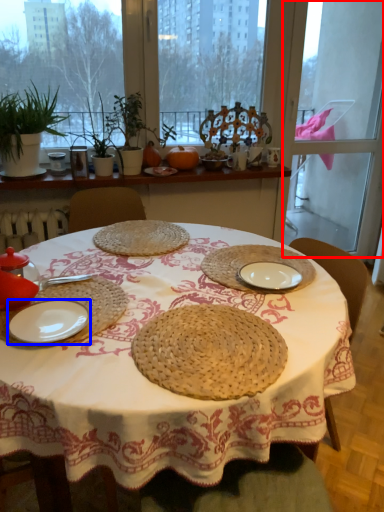
Question: Which object is closer to the camera taking this photo, screen door (highlighted by a red box) or plate (highlighted by a blue box)?

Choices:
 (A) screen door
 (B) plate

Answer: (B)